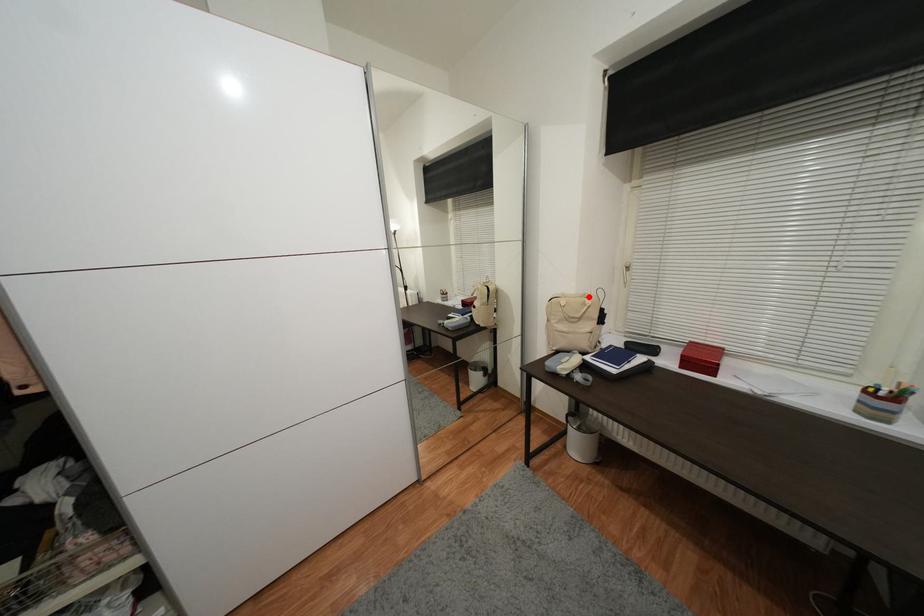
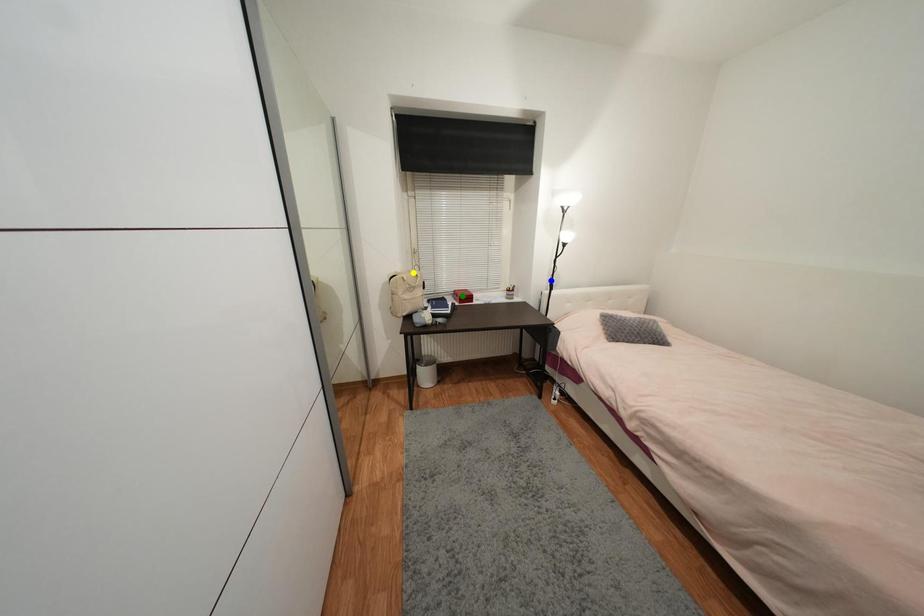
Question: I am providing you with two images of the same scene from different viewpoints. A red point is marked on the first image. You are given multiple points on the second image. Can you choose the point in image 2 that corresponds to the point in image 1?

Choices:
 (A) yellow point
 (B) blue point
 (C) green point

Answer: (A)